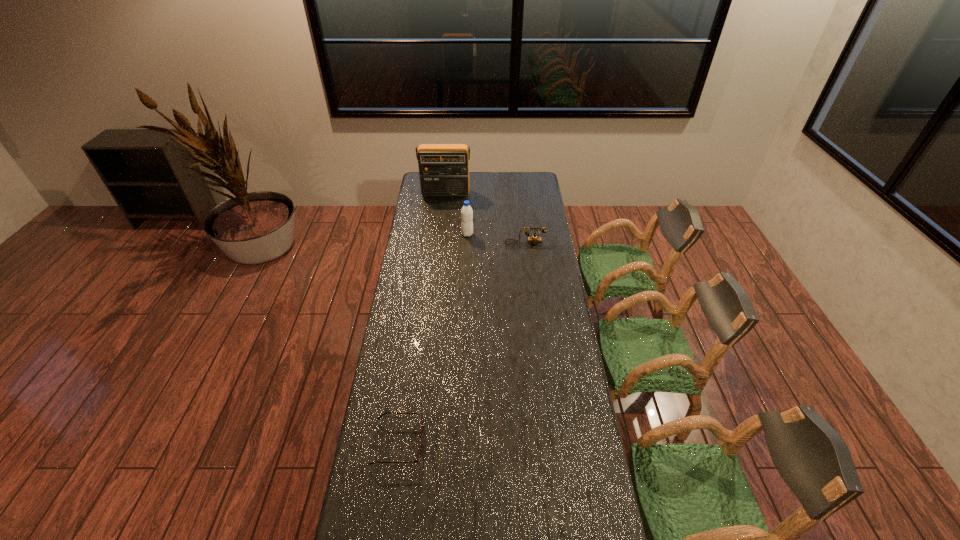
Find the location of a particular element. vacant space situated 0.170m on the front-facing side of the telephone is located at coordinates (528, 267).

You are a GUI agent. You are given a task and a screenshot of the screen. Output one action in this format:
    pyautogui.click(x=<x>, y=<y>)
    Task: Click on the free point located 0.320m on the lenses of the spectacles
    This screenshot has height=540, width=960.
    Given the screenshot: What is the action you would take?
    coord(516,443)

Where is `object that is at the far edge`? object that is at the far edge is located at coordinates (443, 168).

Find the location of a particular element. Image resolution: width=960 pixels, height=540 pixels. radio receiver that is positioned at the left edge is located at coordinates (443, 168).

Locate an element on the screen. This screenshot has height=540, width=960. spectacles at the left edge is located at coordinates (417, 460).

This screenshot has height=540, width=960. In order to click on object that is at the right edge in this screenshot , I will do `click(534, 239)`.

Locate an element on the screen. The height and width of the screenshot is (540, 960). object that is positioned at the far left corner is located at coordinates (443, 168).

You are a GUI agent. You are given a task and a screenshot of the screen. Output one action in this format:
    pyautogui.click(x=<x>, y=<y>)
    Task: Click on the vacant space at the far edge
    The width and height of the screenshot is (960, 540).
    Given the screenshot: What is the action you would take?
    pyautogui.click(x=503, y=185)

In the image, there is a desktop. Where is `vacant space at the left edge`? Image resolution: width=960 pixels, height=540 pixels. vacant space at the left edge is located at coordinates (404, 411).

I want to click on vacant space at the right edge of the desktop, so click(x=525, y=233).